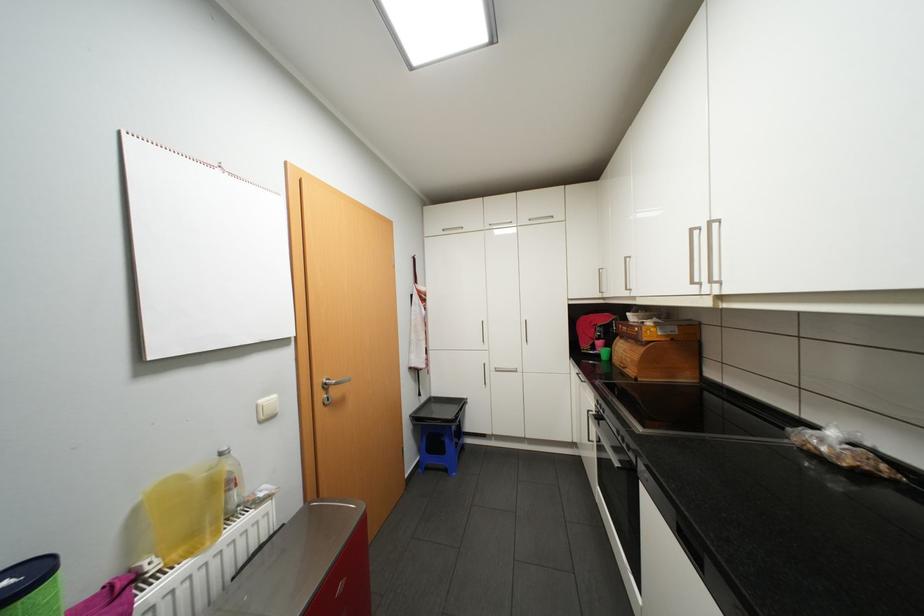
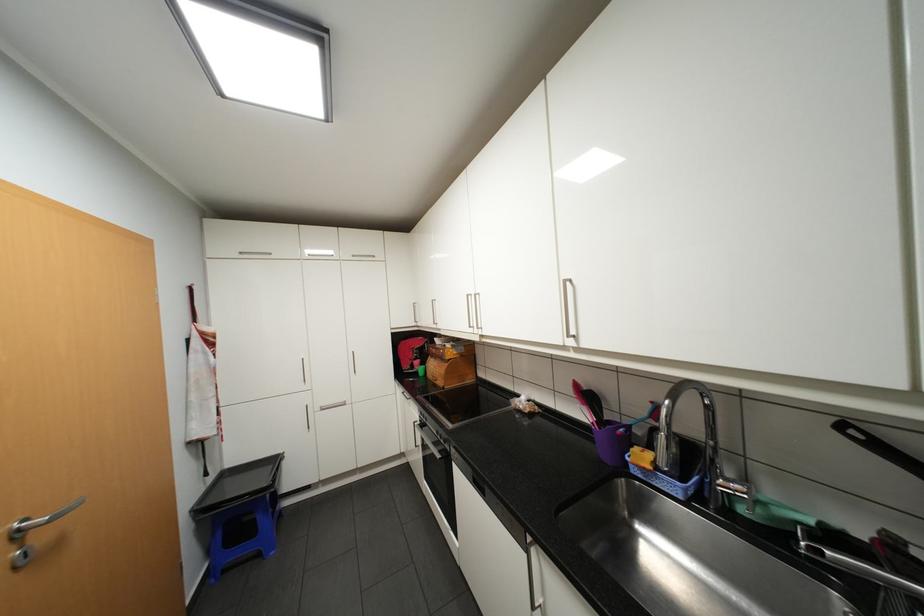
In the second image, find the point that corresponds to (594,292) in the first image.

(412, 322)